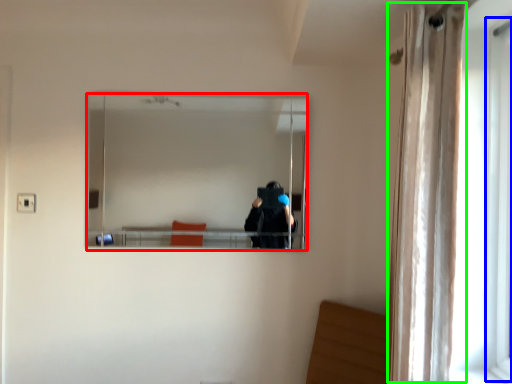
Question: Which is nearer to the mirror (highlighted by a red box)? screen door (highlighted by a blue box) or curtain (highlighted by a green box).

Choices:
 (A) screen door
 (B) curtain

Answer: (B)